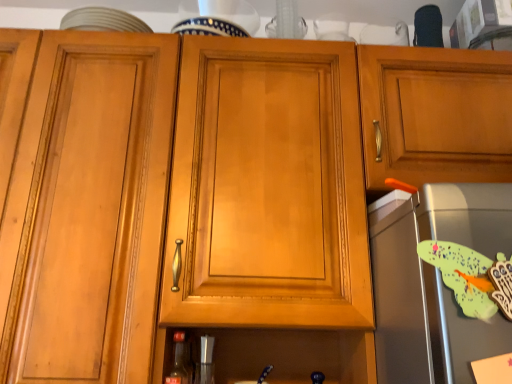
Question: Considering the positions of point (170, 382) and point (198, 365), is point (170, 382) closer or farther from the camera than point (198, 365)?

Choices:
 (A) closer
 (B) farther

Answer: (A)

Question: Is matte glass bottle at lower center spatially inside metallic silver shaker at lower center, arranged as the first appliance when viewed from the left, or outside of it?

Choices:
 (A) inside
 (B) outside

Answer: (B)

Question: Which object is positioned farthest from the satin silver toaster at right, the 2th appliance positioned from the bottom?

Choices:
 (A) metallic silver shaker at lower center, positioned as the 2th appliance in right-to-left order
 (B) matte glass bottle at lower center

Answer: (B)

Question: Based on their relative distances, which object is nearer to the metallic silver shaker at lower center, positioned as the 2th appliance in right-to-left order?

Choices:
 (A) matte glass bottle at lower center
 (B) satin silver toaster at right, positioned as the 1th appliance in front-to-back order

Answer: (A)